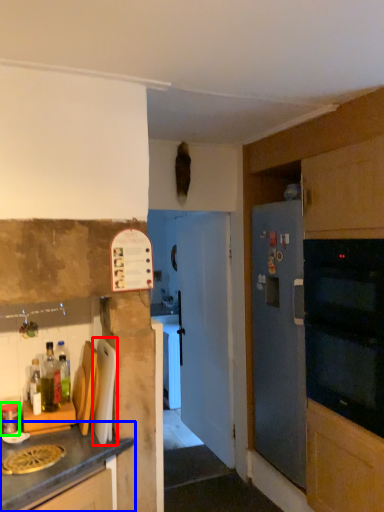
Question: Based on their relative distances, which object is farther from appliance (highlighted by a red box)? Choose from cabinetry (highlighted by a blue box) and kitchen appliance (highlighted by a green box).

Choices:
 (A) cabinetry
 (B) kitchen appliance

Answer: (B)